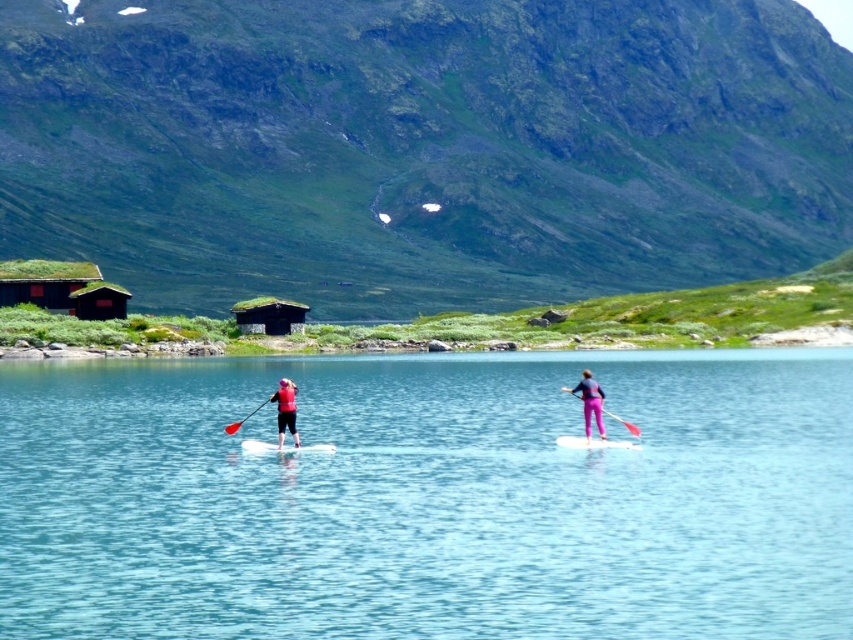
Question: Estimate the real-world distances between objects in this image. Which object is closer to the green mossy rock at upper center?

Choices:
 (A) matte red life vest at center
 (B) white foam kayak at center

Answer: (B)

Question: Considering the relative positions of green mossy rock at upper center and dark brown wooden hut at left in the image provided, where is green mossy rock at upper center located with respect to dark brown wooden hut at left?

Choices:
 (A) right
 (B) left

Answer: (A)

Question: Can you confirm if clear blue water at center is smaller than green mossy roof hut at center?

Choices:
 (A) yes
 (B) no

Answer: (B)

Question: Is dark brown wooden hut at left above green mossy roof hut at center?

Choices:
 (A) yes
 (B) no

Answer: (A)

Question: Estimate the real-world distances between objects in this image. Which object is farther from the white foam kayak at center?

Choices:
 (A) clear blue water at center
 (B) pink fabric paddleboarder at center
 (C) green mossy rock at upper center

Answer: (C)

Question: Which object is the farthest from the white foam kayak at center?

Choices:
 (A) pink fabric paddle at center
 (B) pink matte kayak at center
 (C) pink fabric paddleboarder at center

Answer: (A)